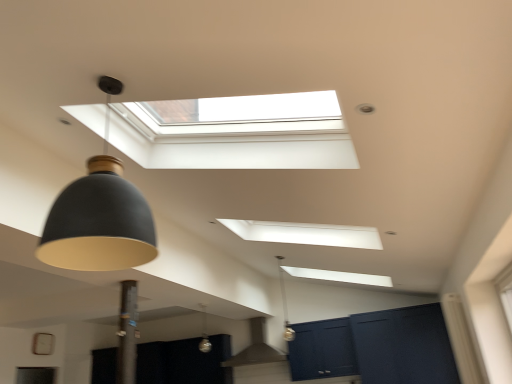
At what (x,y) coordinates should I click in order to perform the action: click on white matte window at right. Please return your answer as a coordinate pair (x, y). Image resolution: width=512 pixels, height=384 pixels. Looking at the image, I should click on (505, 291).

At what (x,y) coordinates should I click in order to perform the action: click on satin silver glass at center, which is counted as the 1th lamp, starting from the left. Please return your answer as a coordinate pair (x, y). This screenshot has height=384, width=512. Looking at the image, I should click on (204, 332).

This screenshot has height=384, width=512. Find the location of `matte gray exhaust hood at center`. matte gray exhaust hood at center is located at coordinates (256, 348).

The height and width of the screenshot is (384, 512). What do you see at coordinates (256, 348) in the screenshot? I see `matte gray exhaust hood at center` at bounding box center [256, 348].

I want to click on matte black lampshade at left, which is the second lamp in right-to-left order, so click(x=99, y=215).

In order to face matte black lampshade at left, placed as the 3th lamp when sorted from bottom to top, should I rotate leftwards or rightwards?

Rotate your view left by about 20.112°.

Identify the location of white matte window at right. This screenshot has width=512, height=384. (505, 291).

Does point (280, 278) lie in front of point (273, 353)?

No, (280, 278) is behind (273, 353).

The height and width of the screenshot is (384, 512). I want to click on the 3rd lamp directly above the matte gray exhaust hood at center (from a real-world perspective), so click(x=284, y=303).

Considering the positions of objects matte black pendant light at center, which is counted as the second lamp, starting from the top, and matte gray exhaust hood at center in the image provided, who is in front, matte black pendant light at center, which is counted as the second lamp, starting from the top, or matte gray exhaust hood at center?

matte black pendant light at center, which is counted as the second lamp, starting from the top, is in front.

Could you tell me if matte black pendant light at center, acting as the 1th lamp starting from the right, is facing matte gray exhaust hood at center?

No.

Is point (236, 364) less distant than point (437, 329)?

No, it is not.

Would you consider matte gray exhaust hood at center to be distant from matte dark blue cabinet at lower right?

That's right, there is a large distance between matte gray exhaust hood at center and matte dark blue cabinet at lower right.

Can you tell me how much matte gray exhaust hood at center and matte dark blue cabinet at lower right differ in facing direction?

0.539 degrees separate the facing orientations of matte gray exhaust hood at center and matte dark blue cabinet at lower right.

Considering the sizes of matte gray exhaust hood at center and matte dark blue cabinet at lower right in the image, is matte gray exhaust hood at center taller or shorter than matte dark blue cabinet at lower right?

matte gray exhaust hood at center is shorter than matte dark blue cabinet at lower right.

Who is shorter, matte black pendant light at center, which is counted as the second lamp, starting from the top, or matte dark blue cabinet at lower right?

matte black pendant light at center, which is counted as the second lamp, starting from the top, is shorter.

From a real-world perspective, who is located lower, matte black pendant light at center, which is counted as the second lamp, starting from the back, or matte dark blue cabinet at lower right?

matte dark blue cabinet at lower right is physically lower.

From the picture: Is matte black pendant light at center, which is the 2th lamp in bottom-to-top order, turned away from matte dark blue cabinet at lower right?

matte black pendant light at center, which is the 2th lamp in bottom-to-top order, is not turned away from matte dark blue cabinet at lower right.

Which point is more forward, (x=284, y=299) or (x=440, y=311)?

The point (x=440, y=311) is more forward.

Is matte black lampshade at left, marked as the 1th lamp in a front-to-back arrangement, thinner than matte gray exhaust hood at center?

Correct, the width of matte black lampshade at left, marked as the 1th lamp in a front-to-back arrangement, is less than that of matte gray exhaust hood at center.

How different are the orientations of matte black lampshade at left, marked as the 1th lamp in a front-to-back arrangement, and matte gray exhaust hood at center in degrees?

The facing directions of matte black lampshade at left, marked as the 1th lamp in a front-to-back arrangement, and matte gray exhaust hood at center are 89.6 degrees apart.

Does matte black lampshade at left, which is the 3th lamp from back to front, have a greater height compared to matte gray exhaust hood at center?

Yes.

In order to click on exhaust hood on the right of matte black lampshade at left, positioned as the first lamp in top-to-bottom order in this screenshot , I will do `click(256, 348)`.

Between matte black lampshade at left, positioned as the first lamp in top-to-bottom order, and matte dark blue cabinet at lower right, which one appears on the right side from the viewer's perspective?

matte dark blue cabinet at lower right.

Looking at this image, choose the correct answer: Is matte black lampshade at left, positioned as the first lamp in top-to-bottom order, inside matte dark blue cabinet at lower right or outside it?

matte black lampshade at left, positioned as the first lamp in top-to-bottom order, cannot be found inside matte dark blue cabinet at lower right.

Considering the points (111, 171) and (350, 318), which point is in front, point (111, 171) or point (350, 318)?

The point (111, 171) is more forward.

Is matte black pendant light at center, which is counted as the second lamp, starting from the back, bigger or smaller than white matte window at right?

In the image, matte black pendant light at center, which is counted as the second lamp, starting from the back, appears to be smaller than white matte window at right.

How many degrees apart are the facing directions of matte black pendant light at center, which is the 2th lamp in bottom-to-top order, and white matte window at right?

matte black pendant light at center, which is the 2th lamp in bottom-to-top order, and white matte window at right are facing 1.16 degrees away from each other.

Between point (283, 307) and point (505, 295), which one is positioned behind?

The point (283, 307) is behind.

From a real-world perspective, which object stands above the other?

From a 3D spatial view, matte black pendant light at center, which is counted as the second lamp, starting from the back, is above.

Does white matte window at right have a lesser height compared to satin silver glass at center, arranged as the third lamp when viewed from the front?

No, white matte window at right is not shorter than satin silver glass at center, arranged as the third lamp when viewed from the front.

Does white matte window at right have a larger size compared to satin silver glass at center, which is counted as the 1th lamp, starting from the left?

Yes.

Considering the positions of objects white matte window at right and satin silver glass at center, the third lamp positioned from the right, in the image provided, who is more to the left, white matte window at right or satin silver glass at center, the third lamp positioned from the right,?

Positioned to the left is satin silver glass at center, the third lamp positioned from the right.

Find the location of a particular element. The image size is (512, 384). exhaust hood below the matte black pendant light at center, acting as the 1th lamp starting from the right (from the image's perspective) is located at coordinates tap(256, 348).

Identify the location of glass door on the right of the matte gray exhaust hood at center. The image size is (512, 384). (404, 346).

When comparing their distances from matte dark blue cabinet at lower right, does white matte window at right or satin silver glass at center, acting as the third lamp starting from the top, seem closer?

satin silver glass at center, acting as the third lamp starting from the top, is positioned closer to the anchor matte dark blue cabinet at lower right.

Looking at the image, which one is located further to matte dark blue cabinet at lower right, matte gray exhaust hood at center or matte black pendant light at center, which is counted as the second lamp, starting from the top?

matte gray exhaust hood at center is positioned further to the anchor matte dark blue cabinet at lower right.

Based on the photo, considering their positions, is satin silver glass at center, the third lamp positioned from the right, positioned further to matte dark blue cabinet at lower right than white matte window at right?

white matte window at right is positioned further to the anchor matte dark blue cabinet at lower right.

When comparing their distances from matte dark blue cabinet at lower right, does white matte window at right or matte black pendant light at center, the 2th lamp in the front-to-back sequence, seem further?

Based on the image, white matte window at right appears to be further to matte dark blue cabinet at lower right.

From the image, which object appears to be farther from white matte window at right, matte gray exhaust hood at center or matte black pendant light at center, acting as the 1th lamp starting from the right?

matte gray exhaust hood at center is positioned further to the anchor white matte window at right.

Based on their spatial positions, is matte black pendant light at center, which is counted as the second lamp, starting from the back, or matte dark blue cabinet at lower right closer to matte black lampshade at left, positioned as the first lamp in top-to-bottom order?

The object closer to matte black lampshade at left, positioned as the first lamp in top-to-bottom order, is matte black pendant light at center, which is counted as the second lamp, starting from the back.

In the scene shown: When comparing their distances from matte black pendant light at center, acting as the 1th lamp starting from the right, does white matte window at right or matte dark blue cabinet at lower right seem closer?

matte dark blue cabinet at lower right is positioned closer to the anchor matte black pendant light at center, acting as the 1th lamp starting from the right.

Based on the photo, considering their positions, is white matte window at right positioned closer to matte dark blue cabinet at lower right than matte gray exhaust hood at center?

The object closer to matte dark blue cabinet at lower right is matte gray exhaust hood at center.

Locate an element on the screen. glass door between matte black lampshade at left, marked as the 1th lamp in a front-to-back arrangement, and matte gray exhaust hood at center in the front-back direction is located at coordinates (404, 346).

At what (x,y) coordinates should I click in order to perform the action: click on lamp located between matte gray exhaust hood at center and matte dark blue cabinet at lower right in the left-right direction. Please return your answer as a coordinate pair (x, y). This screenshot has width=512, height=384. Looking at the image, I should click on (284, 303).

The height and width of the screenshot is (384, 512). What are the coordinates of `window between matte black lampshade at left, placed as the 2th lamp when sorted from left to right, and matte gray exhaust hood at center in the front-back direction` in the screenshot? It's located at (505, 291).

At what (x,y) coordinates should I click in order to perform the action: click on window between matte black lampshade at left, placed as the 3th lamp when sorted from bottom to top, and satin silver glass at center, the first lamp in the bottom-to-top sequence, in the front-back direction. Please return your answer as a coordinate pair (x, y). The image size is (512, 384). Looking at the image, I should click on tap(505, 291).